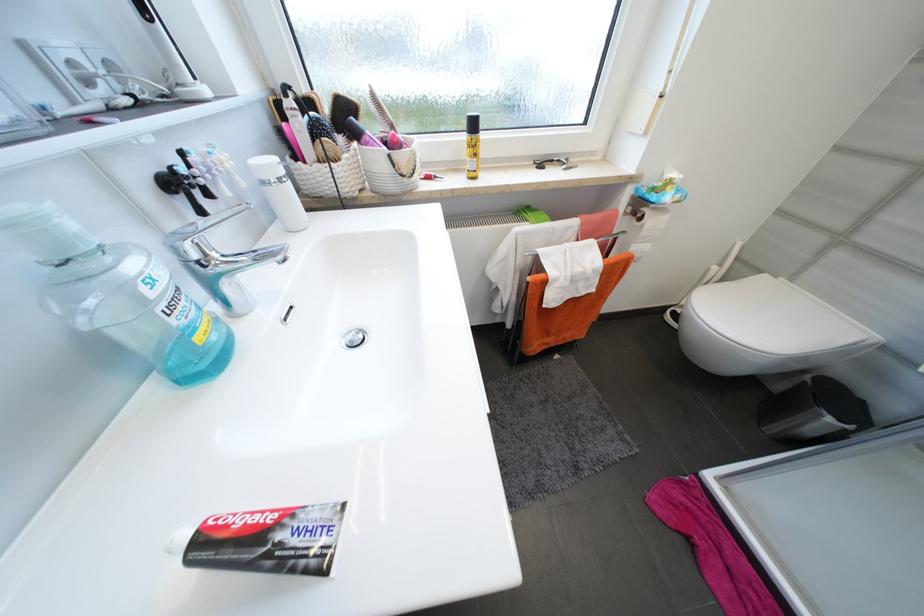
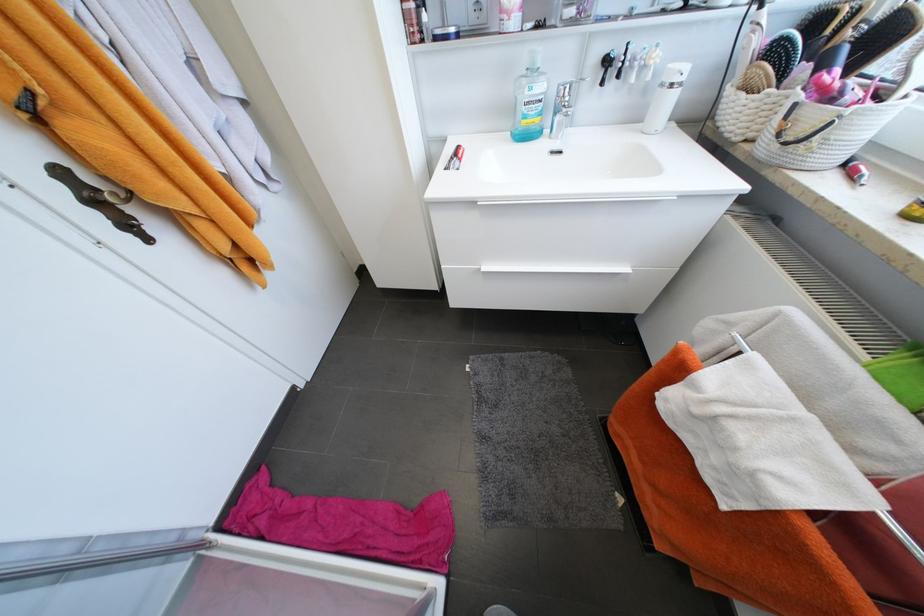
Where in the second image is the point corresponding to (x=203, y=339) from the first image?

(529, 123)